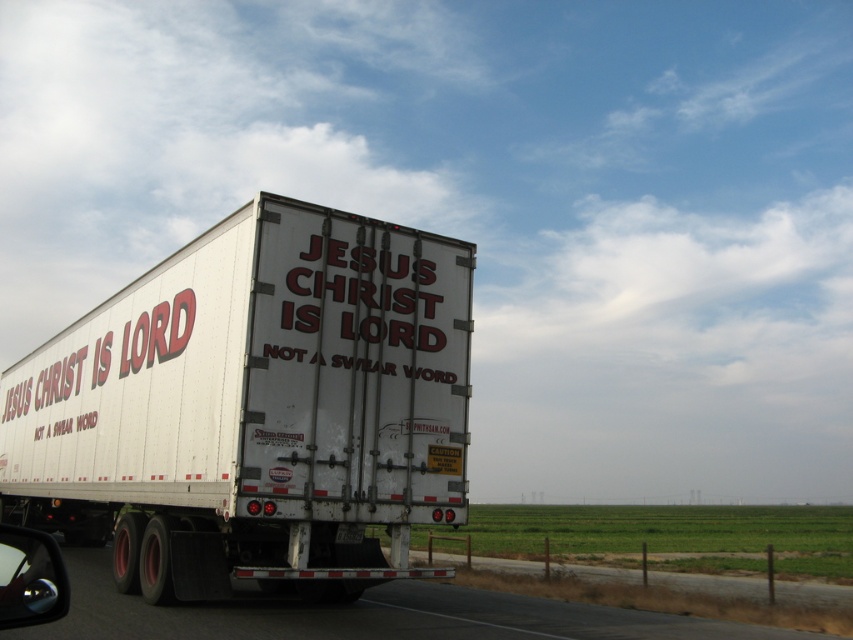
You are a pedestrian standing on the roadside and see the shiny chrome side mirror at lower left and the metallic gray highway at lower center. Which object is positioned to the right of the other?

The metallic gray highway at lower center is positioned to the right of the shiny chrome side mirror at lower left.

You are a driver approaching the white matte trailer truck at center. You notice a specific point on the truck at coordinates (254, 406). What object is located at this point?

The point at coordinates (254, 406) corresponds to the white matte trailer truck at center.

You are a delivery driver who needs to navigate a narrow bridge that can only accommodate vehicles up to the width of the shiny chrome side mirror at lower left. Based on the image, can the white matte trailer truck at center safely pass through this bridge?

The white matte trailer truck at center might be wider than the shiny chrome side mirror at lower left, so there is a possibility that the truck cannot safely pass through the bridge designed for vehicles up to the mirror width.